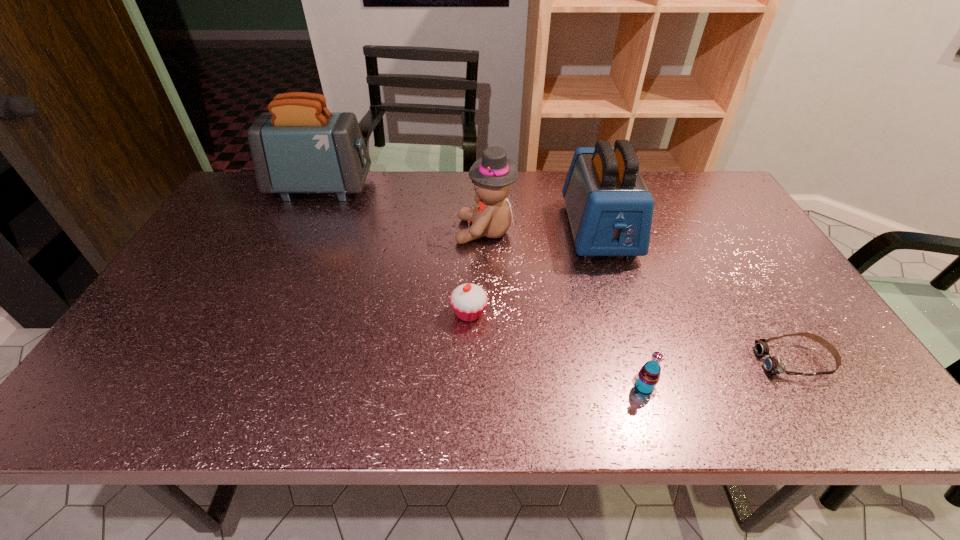
The height and width of the screenshot is (540, 960). I want to click on vacant space in between the rag_doll and the shortest object, so click(x=640, y=296).

The width and height of the screenshot is (960, 540). Identify the location of vacant area between the fourth farthest object and the soda. (557, 350).

This screenshot has width=960, height=540. In order to click on free spot between the right toaster and the rag_doll in this screenshot , I will do `click(542, 231)`.

Identify the location of free point between the fifth tallest object and the shortest object. (632, 337).

I want to click on free point between the shorter toaster and the leftmost object, so click(461, 209).

You are a GUI agent. You are given a task and a screenshot of the screen. Output one action in this format:
    pyautogui.click(x=<x>, y=<y>)
    Task: Click on the free point between the left toaster and the soda
    
    Given the screenshot: What is the action you would take?
    pyautogui.click(x=483, y=287)

Locate an element on the screen. Image resolution: width=960 pixels, height=540 pixels. vacant area that lies between the left toaster and the goggles is located at coordinates (558, 274).

The width and height of the screenshot is (960, 540). Find the location of `free area in between the leftmost object and the goggles`. free area in between the leftmost object and the goggles is located at coordinates (558, 274).

Locate an element on the screen. free point between the cupcake and the rag_doll is located at coordinates (477, 272).

At what (x,y) coordinates should I click in order to perform the action: click on unoccupied area between the soda and the rightmost object. Please return your answer as a coordinate pair (x, y). This screenshot has height=540, width=960. Looking at the image, I should click on (719, 374).